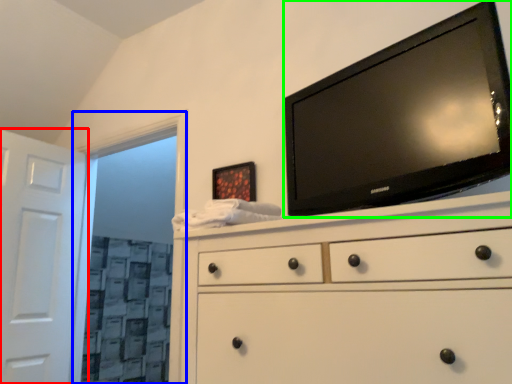
Question: Based on their relative distances, which object is farther from door (highlighted by a red box)? Choose from glass door (highlighted by a blue box) and television (highlighted by a green box).

Choices:
 (A) glass door
 (B) television

Answer: (B)